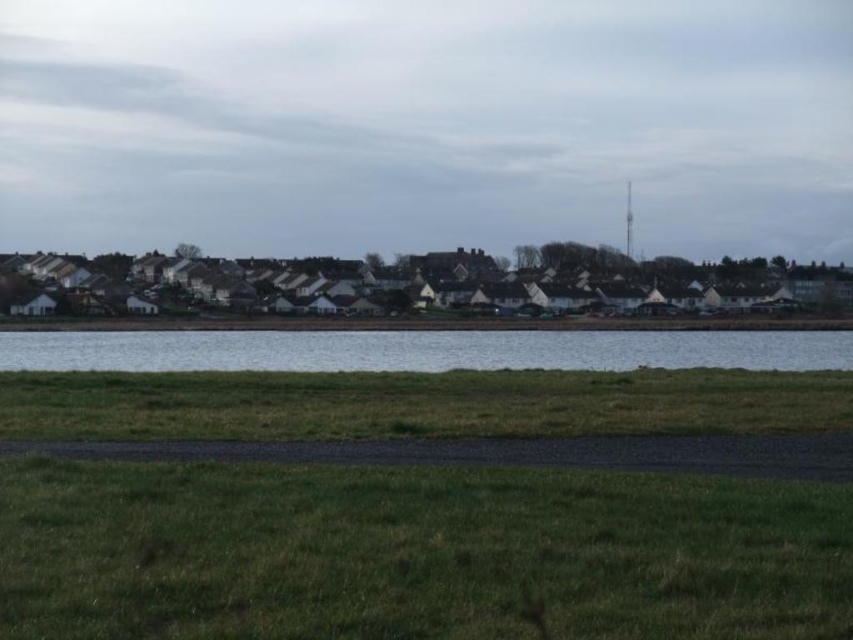
Is green grass at lower center thinner than clear water at center?

Indeed, green grass at lower center has a lesser width compared to clear water at center.

Is green grass at lower center wider than clear water at center?

Incorrect, green grass at lower center's width does not surpass clear water at center's.

Find the location of a particular element. This screenshot has width=853, height=640. green grass at lower center is located at coordinates (415, 552).

Locate an element on the screen. The image size is (853, 640). green grass at lower center is located at coordinates (415, 552).